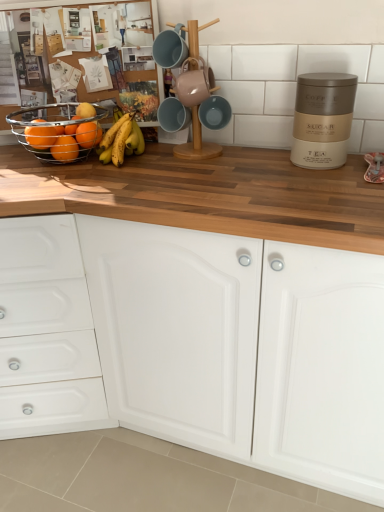
At what (x,y) coordinates should I click in order to perform the action: click on matte orange at left, marked as the third orange in a back-to-front arrangement. Please return your answer as a coordinate pair (x, y). Image resolution: width=384 pixels, height=512 pixels. Looking at the image, I should click on (40, 137).

I want to click on metallic wire basket at left, which appears as the first orange when viewed from the front, so click(x=47, y=133).

What are the coordinates of `orange matte at left, the first orange in the back-to-front sequence` in the screenshot? It's located at (88, 134).

This screenshot has width=384, height=512. Describe the element at coordinates (65, 149) in the screenshot. I see `matte orange fruit at left, the second orange when ordered from back to front` at that location.

The width and height of the screenshot is (384, 512). Identify the location of matte orange at left, which is the 2th orange in front-to-back order. (40, 137).

From the image's perspective, starting from the orange matte at left, positioned as the fourth orange in front-to-back order, which orange is the 2nd one below? Please provide its 2D coordinates.

[(65, 149)]

From a real-world perspective, which is physically below, orange matte at left, the first orange in the back-to-front sequence, or matte orange fruit at left, positioned as the third orange in front-to-back order?

matte orange fruit at left, positioned as the third orange in front-to-back order, is physically lower.

Considering the relative sizes of orange matte at left, positioned as the fourth orange in front-to-back order, and matte orange fruit at left, positioned as the third orange in front-to-back order, in the image provided, is orange matte at left, positioned as the fourth orange in front-to-back order, bigger than matte orange fruit at left, positioned as the third orange in front-to-back order,?

No, orange matte at left, positioned as the fourth orange in front-to-back order, is not bigger than matte orange fruit at left, positioned as the third orange in front-to-back order.

Is orange matte at left, the first orange in the back-to-front sequence, surrounding matte orange fruit at left, positioned as the third orange in front-to-back order?

No, orange matte at left, the first orange in the back-to-front sequence, does not contain matte orange fruit at left, positioned as the third orange in front-to-back order.

Is matte orange at left, which is the 2th orange in front-to-back order, to the left of white matte cabinet at center from the viewer's perspective?

Yes.

Can white matte cabinet at center be found inside matte orange at left, marked as the third orange in a back-to-front arrangement?

No, white matte cabinet at center is not a part of matte orange at left, marked as the third orange in a back-to-front arrangement.

Which object is closer to the camera taking this photo, matte orange at left, which is the 2th orange in front-to-back order, or white matte cabinet at center?

white matte cabinet at center is closer to the camera.

The height and width of the screenshot is (512, 384). Identify the location of cabinetry lying on the right of matte orange at left, marked as the third orange in a back-to-front arrangement. (197, 343).

Can you confirm if metallic wire basket at left, acting as the 4th orange starting from the back, is wider than matte orange fruit at left, positioned as the third orange in front-to-back order?

Yes.

Is metallic wire basket at left, which appears as the first orange when viewed from the front, looking in the opposite direction of matte orange fruit at left, positioned as the third orange in front-to-back order?

metallic wire basket at left, which appears as the first orange when viewed from the front, is not turned away from matte orange fruit at left, positioned as the third orange in front-to-back order.

How far apart are metallic wire basket at left, which appears as the first orange when viewed from the front, and matte orange fruit at left, the second orange when ordered from back to front?

The distance of metallic wire basket at left, which appears as the first orange when viewed from the front, from matte orange fruit at left, the second orange when ordered from back to front, is 6.92 centimeters.

Which is less distant, (50, 127) or (68, 155)?

Clearly, point (50, 127) is closer to the camera than point (68, 155).

Is matte orange fruit at left, the second orange when ordered from back to front, oriented away from white matte cabinet at center?

No.

Is matte orange fruit at left, positioned as the third orange in front-to-back order, thinner than white matte cabinet at center?

Correct, the width of matte orange fruit at left, positioned as the third orange in front-to-back order, is less than that of white matte cabinet at center.

Is white matte cabinet at center surrounded by matte orange fruit at left, positioned as the third orange in front-to-back order?

No, white matte cabinet at center is not inside matte orange fruit at left, positioned as the third orange in front-to-back order.

Which of these two, white matte cabinet at center or matte orange at left, which is the 2th orange in front-to-back order, is smaller?

matte orange at left, which is the 2th orange in front-to-back order, is smaller.

Considering the sizes of objects white matte cabinet at center and matte orange at left, marked as the third orange in a back-to-front arrangement, in the image provided, who is wider, white matte cabinet at center or matte orange at left, marked as the third orange in a back-to-front arrangement,?

white matte cabinet at center is wider.

From the image's perspective, is white matte cabinet at center positioned above or below matte orange at left, which is the 2th orange in front-to-back order?

white matte cabinet at center is below matte orange at left, which is the 2th orange in front-to-back order.

From a real-world perspective, does white matte cabinet at center stand above matte orange at left, marked as the third orange in a back-to-front arrangement?

No.

Who is smaller, matte orange at left, marked as the third orange in a back-to-front arrangement, or orange matte at left, positioned as the fourth orange in front-to-back order?

With smaller size is orange matte at left, positioned as the fourth orange in front-to-back order.

From a real-world perspective, which object rests below the other?

orange matte at left, positioned as the fourth orange in front-to-back order, is physically lower.

Does matte orange at left, marked as the third orange in a back-to-front arrangement, appear on the left side of orange matte at left, positioned as the fourth orange in front-to-back order?

Yes, matte orange at left, marked as the third orange in a back-to-front arrangement, is to the left of orange matte at left, positioned as the fourth orange in front-to-back order.

Is matte orange at left, which is the 2th orange in front-to-back order, looking in the opposite direction of orange matte at left, the first orange in the back-to-front sequence?

matte orange at left, which is the 2th orange in front-to-back order, does not have its back to orange matte at left, the first orange in the back-to-front sequence.

Is matte orange at left, which is the 2th orange in front-to-back order, positioned with its back to metallic wire basket at left, acting as the 4th orange starting from the back?

Yes, matte orange at left, which is the 2th orange in front-to-back order, is facing away from metallic wire basket at left, acting as the 4th orange starting from the back.

Is matte orange at left, marked as the third orange in a back-to-front arrangement, to the right of metallic wire basket at left, which appears as the first orange when viewed from the front, from the viewer's perspective?

No, matte orange at left, marked as the third orange in a back-to-front arrangement, is not to the right of metallic wire basket at left, which appears as the first orange when viewed from the front.

Is matte orange at left, marked as the third orange in a back-to-front arrangement, in front of metallic wire basket at left, acting as the 4th orange starting from the back?

That is False.

The width and height of the screenshot is (384, 512). I want to click on orange that is behind the matte orange fruit at left, the second orange when ordered from back to front, so click(88, 134).

This screenshot has width=384, height=512. I want to click on orange that is the 2nd object located above the white matte cabinet at center (from the image's perspective), so click(40, 137).

Considering their positions, is white matte cabinet at center positioned further to yellow matte bananas at center than orange matte at left, positioned as the fourth orange in front-to-back order?

The object further to yellow matte bananas at center is white matte cabinet at center.

Based on their spatial positions, is matte orange fruit at left, the second orange when ordered from back to front, or yellow matte bananas at center closer to matte orange at left, marked as the third orange in a back-to-front arrangement?

Based on the image, matte orange fruit at left, the second orange when ordered from back to front, appears to be nearer to matte orange at left, marked as the third orange in a back-to-front arrangement.

Considering their positions, is white matte cabinet at center positioned further to matte orange at left, which is the 2th orange in front-to-back order, than yellow matte bananas at center?

Based on the image, white matte cabinet at center appears to be further to matte orange at left, which is the 2th orange in front-to-back order.

Estimate the real-world distances between objects in this image. Which object is closer to matte orange at left, which is the 2th orange in front-to-back order, yellow matte bananas at center or matte orange fruit at left, the second orange when ordered from back to front?

matte orange fruit at left, the second orange when ordered from back to front, lies closer to matte orange at left, which is the 2th orange in front-to-back order, than the other object.

When comparing their distances from matte orange fruit at left, the second orange when ordered from back to front, does yellow matte bananas at center or orange matte at left, the first orange in the back-to-front sequence, seem closer?

orange matte at left, the first orange in the back-to-front sequence, lies closer to matte orange fruit at left, the second orange when ordered from back to front, than the other object.

Which object lies nearer to the anchor point matte orange fruit at left, positioned as the third orange in front-to-back order, matte orange at left, which is the 2th orange in front-to-back order, or white matte cabinet at center?

matte orange at left, which is the 2th orange in front-to-back order.

Considering their positions, is orange matte at left, the first orange in the back-to-front sequence, positioned closer to white matte cabinet at center than yellow matte bananas at center?

yellow matte bananas at center lies closer to white matte cabinet at center than the other object.

When comparing their distances from white matte cabinet at center, does matte orange fruit at left, positioned as the third orange in front-to-back order, or metallic wire basket at left, which appears as the first orange when viewed from the front, seem further?

The object further to white matte cabinet at center is matte orange fruit at left, positioned as the third orange in front-to-back order.

Locate an element on the screen. This screenshot has width=384, height=512. banana between matte orange at left, which is the 2th orange in front-to-back order, and white matte cabinet at center, in the horizontal direction is located at coordinates (121, 141).

Image resolution: width=384 pixels, height=512 pixels. Find the location of `orange located between metallic wire basket at left, acting as the 4th orange starting from the back, and matte orange fruit at left, positioned as the third orange in front-to-back order, in the depth direction`. orange located between metallic wire basket at left, acting as the 4th orange starting from the back, and matte orange fruit at left, positioned as the third orange in front-to-back order, in the depth direction is located at coordinates (40, 137).

Find the location of `orange between matte orange fruit at left, positioned as the third orange in front-to-back order, and white matte cabinet at center, in the horizontal direction`. orange between matte orange fruit at left, positioned as the third orange in front-to-back order, and white matte cabinet at center, in the horizontal direction is located at coordinates (88, 134).

Locate an element on the screen. orange located between matte orange fruit at left, positioned as the third orange in front-to-back order, and yellow matte bananas at center in the left-right direction is located at coordinates (88, 134).